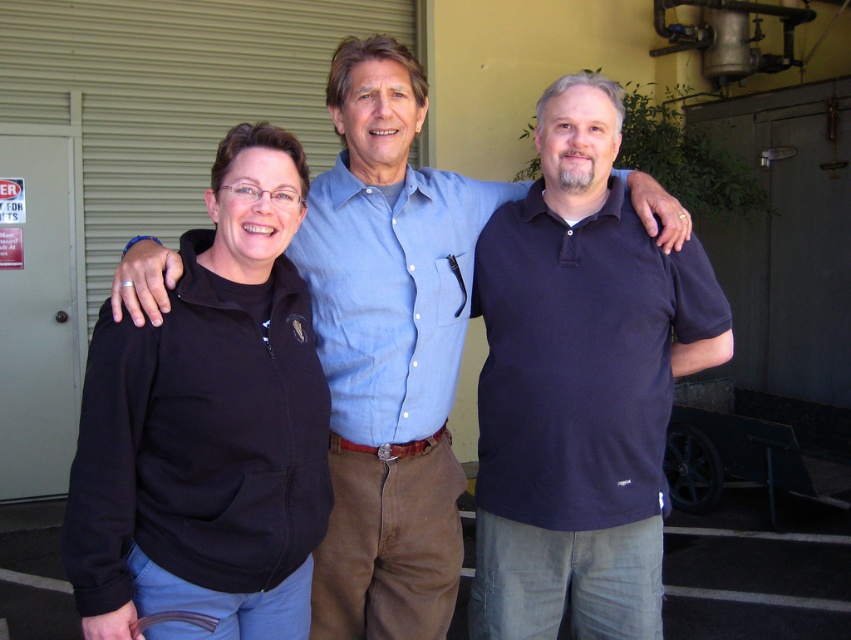
You are a photographer trying to adjust the focus on your camera. You need to ensure that both the dark blue polo shirt at center and the blue cotton shirt at center are in focus. Which shirt should you focus on first to account for their height difference?

The dark blue polo shirt at center is not as tall as the blue cotton shirt at center, so you should focus on the blue cotton shirt at center first since it is taller and will require adjusting the focus to capture both properly.

You are a photographer trying to adjust the focus on your camera. You want to ensure that both the black fleece jacket at left and the blue cotton shirt at center are in focus. Considering their sizes, which one should you set the focus on first to ensure both are clear?

Since the black fleece jacket at left is smaller in size compared to the blue cotton shirt at center, you should focus on the smaller black fleece jacket at left first. This ensures that the smaller details are sharp, and the larger blue cotton shirt at center will naturally fall into focus as well.

Consider the image. You are standing in front of the white metal door at left and want to hand a package to the person wearing the black fleece jacket at left. Can you reach them without moving from your current position?

The black fleece jacket at left is closer to the viewer than the white metal door at left, so yes, you can reach them without moving from your current position.